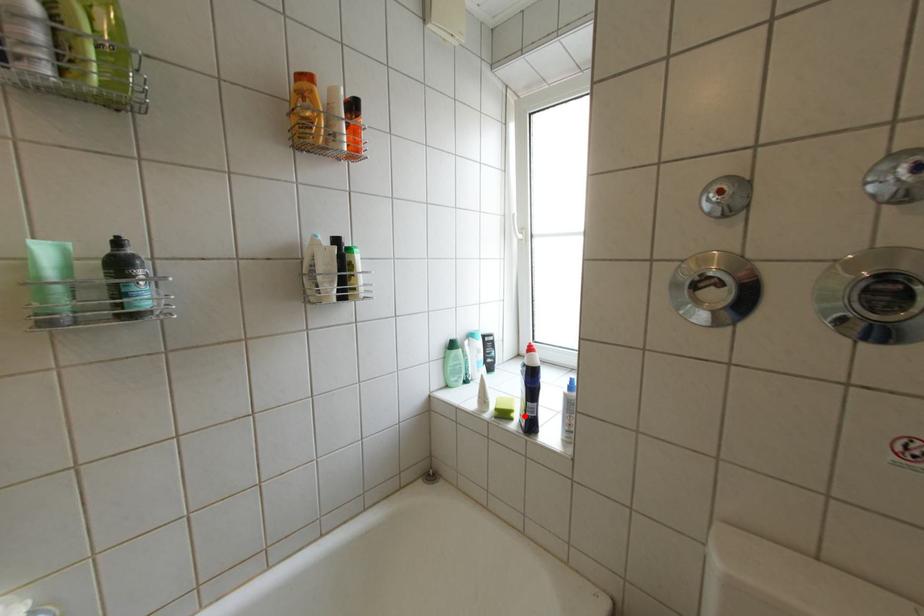
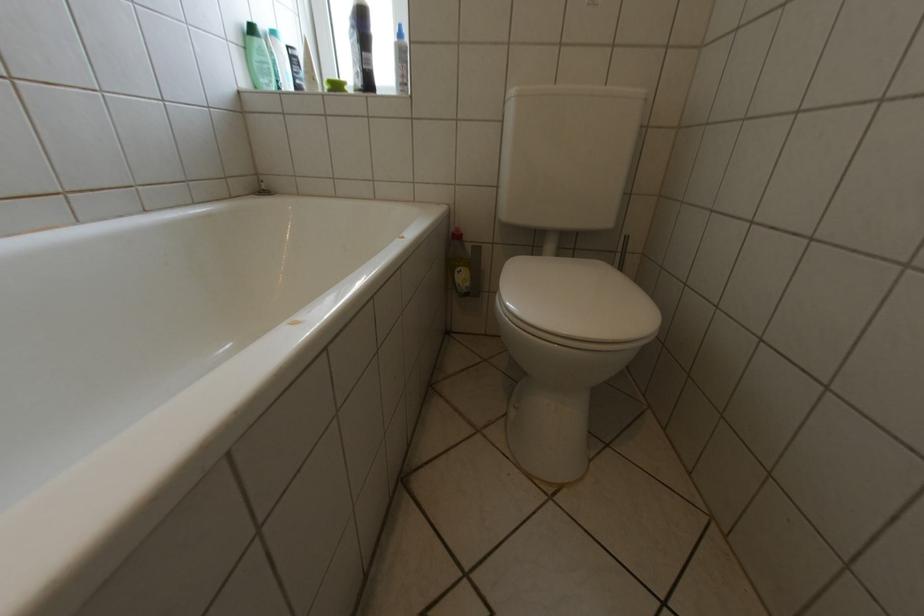
In the second image, find the point that corresponds to the highlighted location in the first image.

(359, 90)